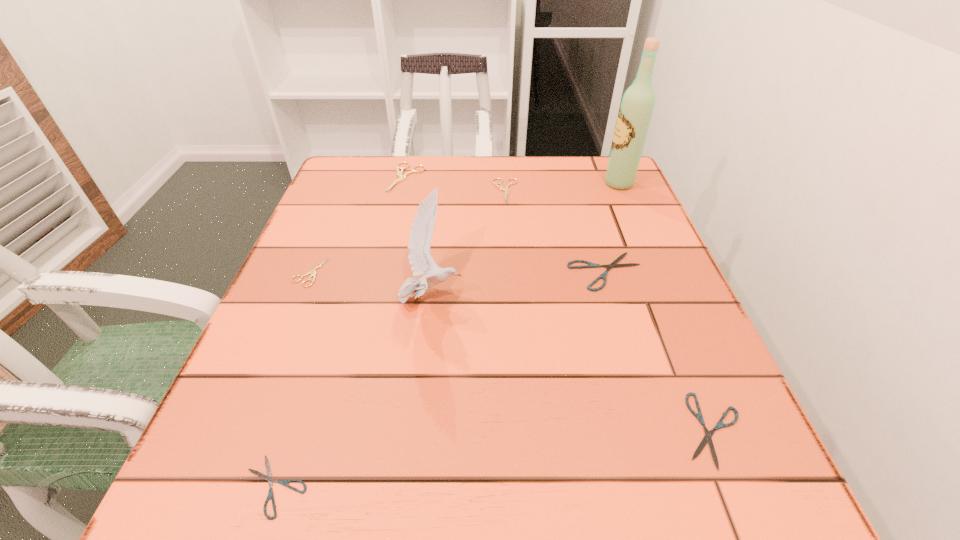
This screenshot has height=540, width=960. Identify the location of white wine bottle. (637, 106).

Locate an element on the screen. wine bottle is located at coordinates (637, 106).

At what (x,y) coordinates should I click in order to perform the action: click on gull. Please return your answer as a coordinate pair (x, y). The width and height of the screenshot is (960, 540). Looking at the image, I should click on (421, 262).

Identify the location of white gull. The width and height of the screenshot is (960, 540). (421, 262).

Find the location of a particular element. the tallest shears is located at coordinates (399, 173).

You are a GUI agent. You are given a task and a screenshot of the screen. Output one action in this format:
    pyautogui.click(x=<x>, y=<y>)
    Task: Click on the sixth shortest object
    
    Given the screenshot: What is the action you would take?
    pyautogui.click(x=399, y=173)

You are a GUI agent. You are given a task and a screenshot of the screen. Output one action in this format:
    pyautogui.click(x=<x>, y=<y>)
    Task: Click on the fifth shortest object
    
    Given the screenshot: What is the action you would take?
    pyautogui.click(x=500, y=187)

I want to click on the second biggest beige shears, so click(500, 187).

Locate an element on the screen. This screenshot has height=540, width=960. the farthest black shears is located at coordinates (614, 264).

Locate an element on the screen. The width and height of the screenshot is (960, 540). the smallest beige shears is located at coordinates (313, 272).